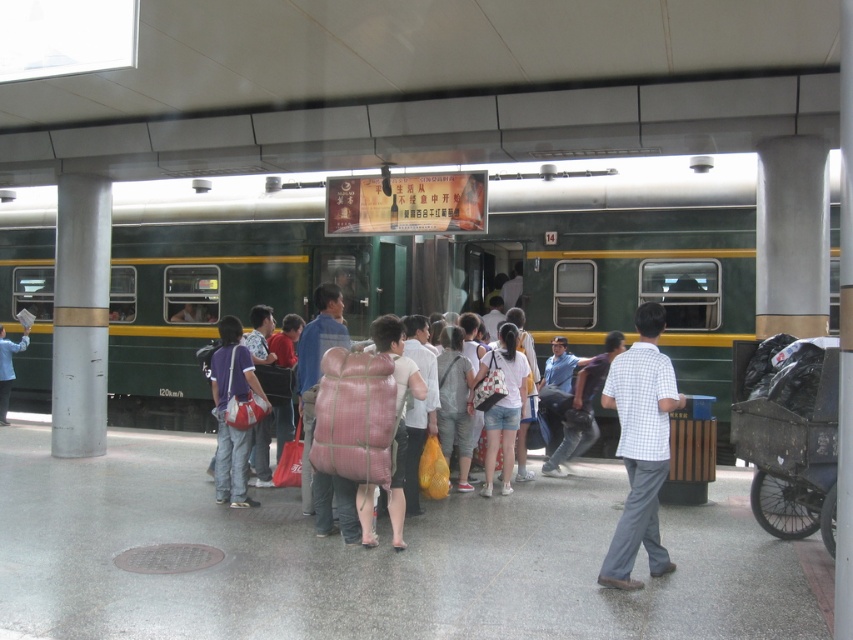
Which is above, green matte train at center or matte black shirt at center?

green matte train at center

Can you confirm if green matte train at center is positioned above matte black shirt at center?

Yes.

Between point (399, 266) and point (0, 394), which one is positioned behind?

The point (0, 394) is behind.

Where is `green matte train at center`? Image resolution: width=853 pixels, height=640 pixels. green matte train at center is located at coordinates (444, 264).